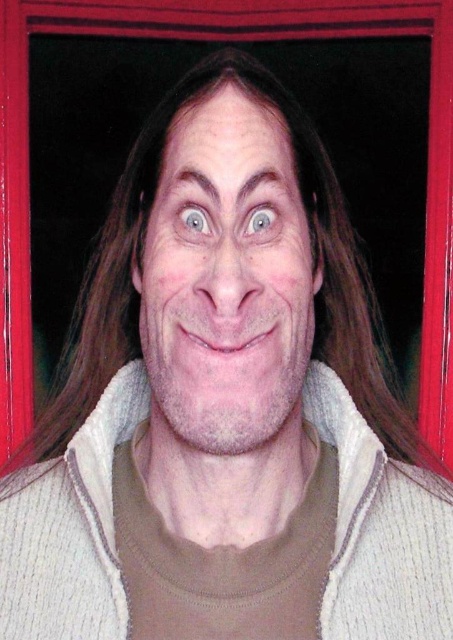
You are standing in front of a person wearing a beige sweater with a white fleece collar. There are two points marked on the image, one at coordinates point (235, 154) and another at point (115, 608). Which point is closer to you?

Point (235, 154) is in front of point (115, 608), so it is closer to you.

You are a fashion designer analyzing this image. You need to determine which item takes up more space in the composition between the white textured sweater at center and the blue glossy eye at center. Which one is it?

The white textured sweater at center is larger in size than the blue glossy eye at center, so the white textured sweater at center takes up more space in the composition.